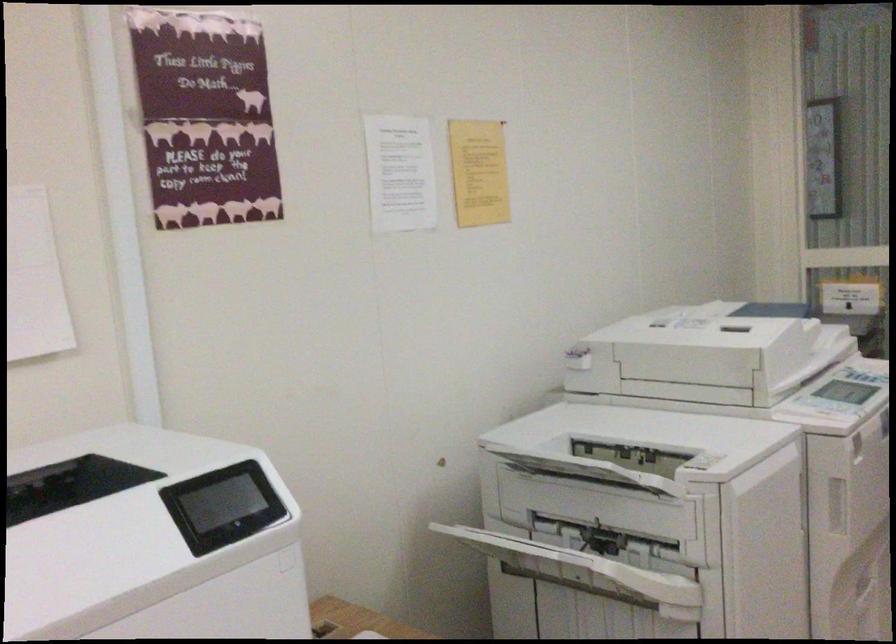
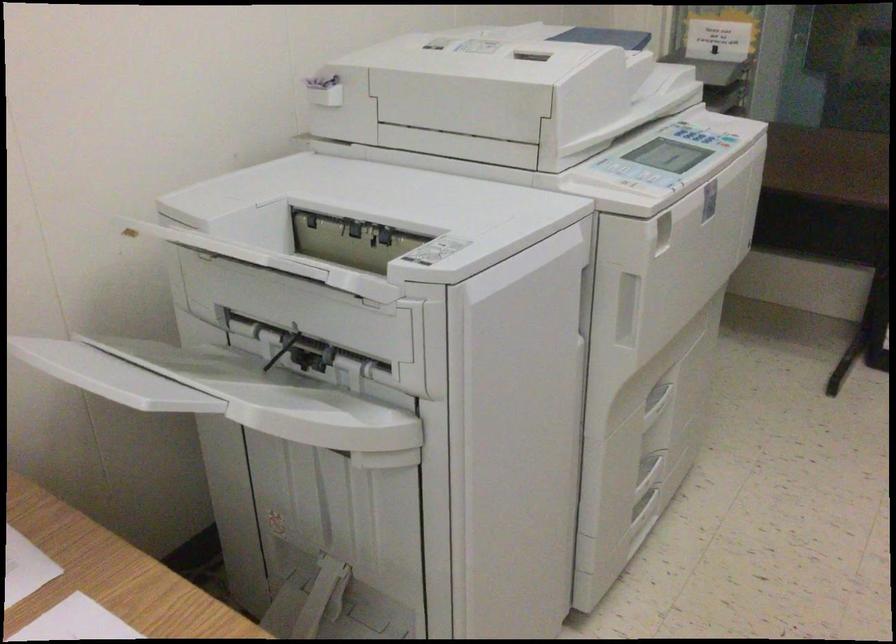
The images are taken continuously from a first-person perspective. In which direction are you moving?

The cameraman moved toward right, forward.